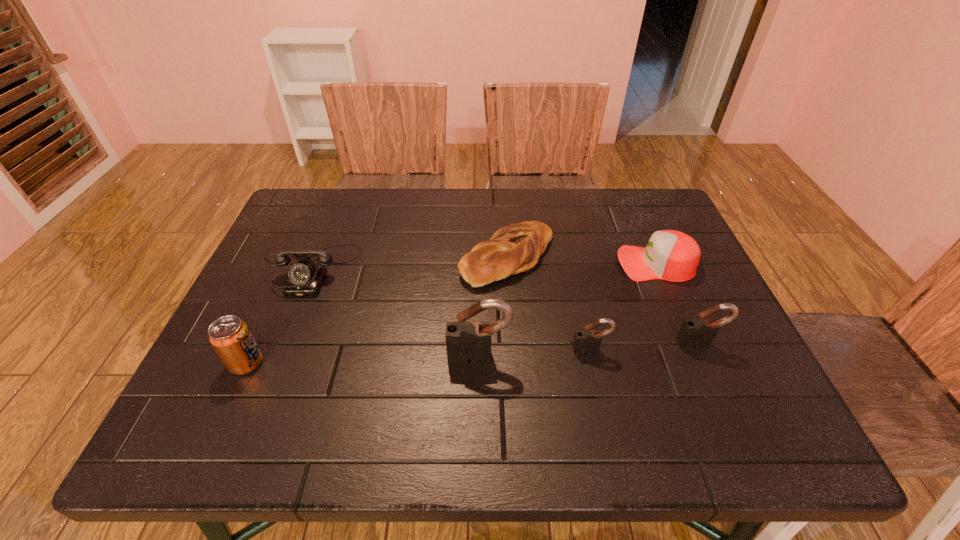
The height and width of the screenshot is (540, 960). Find the location of `free spot between the soda can and the shortest padlock`. free spot between the soda can and the shortest padlock is located at coordinates (419, 356).

Locate an element on the screen. This screenshot has height=540, width=960. free spot between the baseball cap and the fifth object from left to right is located at coordinates (x=623, y=306).

Where is `free space between the soda can and the baseball cap`? free space between the soda can and the baseball cap is located at coordinates (451, 313).

The image size is (960, 540). In order to click on vacant area that lies between the soda can and the telephone in this screenshot , I will do `click(280, 316)`.

Where is `vacant space that's between the shortest object and the second padlock from left to right`? Image resolution: width=960 pixels, height=540 pixels. vacant space that's between the shortest object and the second padlock from left to right is located at coordinates (549, 303).

Identify the location of vacant point located between the bread and the telephone. The width and height of the screenshot is (960, 540). (411, 263).

Image resolution: width=960 pixels, height=540 pixels. In order to click on free spot between the bread and the baseball cap in this screenshot , I will do `click(582, 260)`.

Where is `vacant space that is in between the leftmost padlock and the shortest padlock`? The image size is (960, 540). vacant space that is in between the leftmost padlock and the shortest padlock is located at coordinates (535, 353).

Locate an element on the screen. Image resolution: width=960 pixels, height=540 pixels. free space that is in between the second shortest padlock and the baseball cap is located at coordinates (678, 303).

Locate which object ranks fourth in proximity to the baseball cap. Please provide its 2D coordinates. Your answer should be formatted as a tuple, i.e. [(x, y)], where the tuple contains the x and y coordinates of a point satisfying the conditions above.

[(468, 342)]